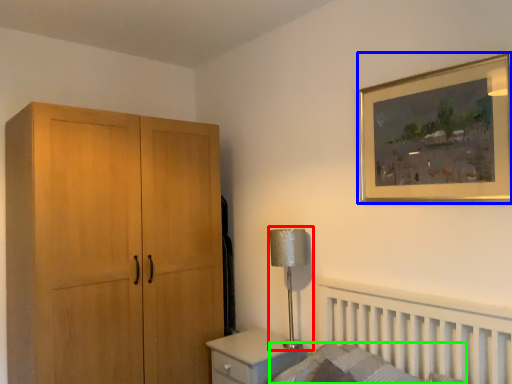
Question: Which object is positioned farthest from table lamp (highlighted by a red box)? Select from picture frame (highlighted by a blue box) and mattress (highlighted by a green box).

Choices:
 (A) picture frame
 (B) mattress

Answer: (A)